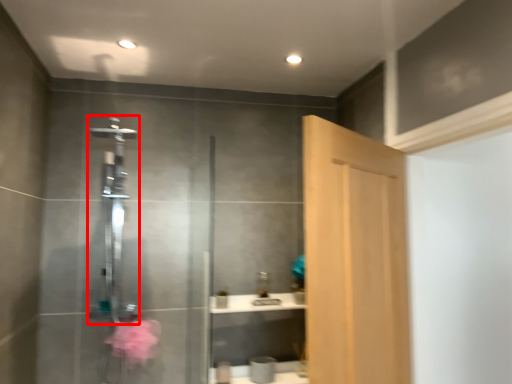
Question: From the image, what is the correct spatial relationship of shower (annotated by the red box) in relation to door?

Choices:
 (A) right
 (B) left

Answer: (B)